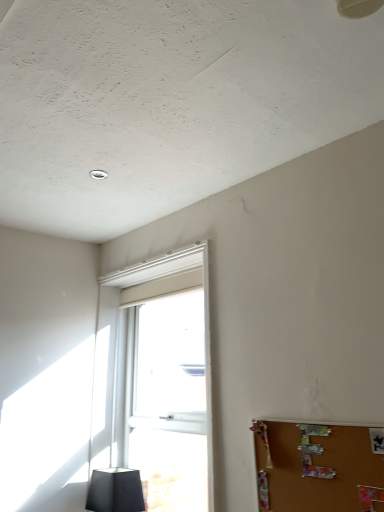
Question: From a real-world perspective, is brown corkboard at lower right positioned above or below matte black lampshade at lower left?

Choices:
 (A) above
 (B) below

Answer: (A)

Question: Is brown corkboard at lower right in front of or behind matte black lampshade at lower left in the image?

Choices:
 (A) behind
 (B) front

Answer: (B)

Question: Estimate the real-world distances between objects in this image. Which object is closer to the brown corkboard at lower right?

Choices:
 (A) white plastic window at center
 (B) matte black lampshade at lower left

Answer: (A)

Question: Which is nearer to the brown corkboard at lower right?

Choices:
 (A) white plastic window at center
 (B) matte black lampshade at lower left

Answer: (A)